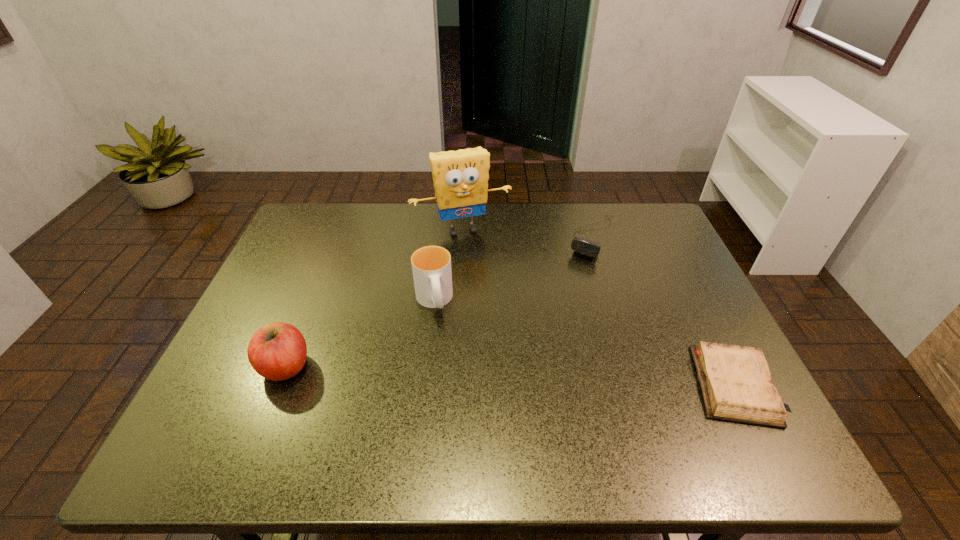
Identify the location of vacant space on the desktop that is between the leftmost object and the rightmost object and is positioned on the face of the sponge. (522, 376).

Where is `free space on the desktop that is between the apple and the diary and is positioned on the front-facing side of the second object from right to left`? free space on the desktop that is between the apple and the diary and is positioned on the front-facing side of the second object from right to left is located at coordinates pyautogui.click(x=513, y=376).

The width and height of the screenshot is (960, 540). What are the coordinates of `free space on the desktop that is between the leftmost object and the rightmost object and is positioned with the handle on the side of the third nearest object` in the screenshot? It's located at (448, 373).